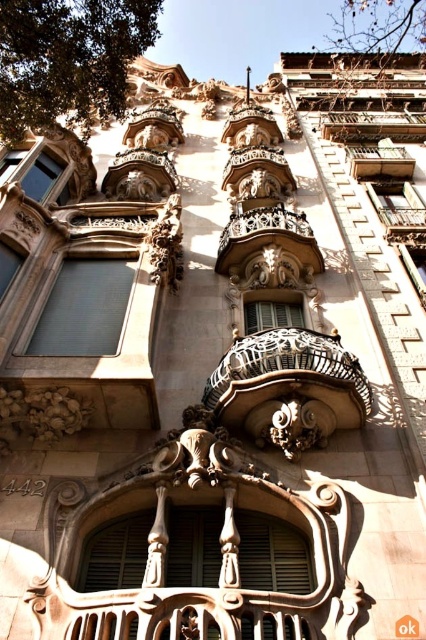
You are an architect analyzing the building facade. The polished bronze balcony at center is part of the structure. Based on its position, can you determine if it is positioned higher than the lower half of the building?

The polished bronze balcony at center is located at point coordinates approximately 0.375 on the horizontal axis and 0.627 on the vertical axis. Since the vertical coordinate 0.627 exceeds 0.5, it is positioned above the halfway point of the building, meaning it is in the upper half. Therefore, the polished bronze balcony at center is indeed higher than the lower half of the building.

You are standing in front of the building and want to take a photo of the point at coordinates point (227,236). If your camera has a focal length of 50mm and you are 76.14 meters away from the point, what is the angle of view required to capture the entire point in the frame?

The point at coordinates point (227,236) is 76.14 meters away from the viewer. To calculate the angle of view needed, use the formula angle of view formula. However, since the point is a single coordinate without dimensions, the angle of view required would depend on the camera sensor size and the desired framing. Without additional details on the point size or sensor dimensions, an exact angle cannot be determined.